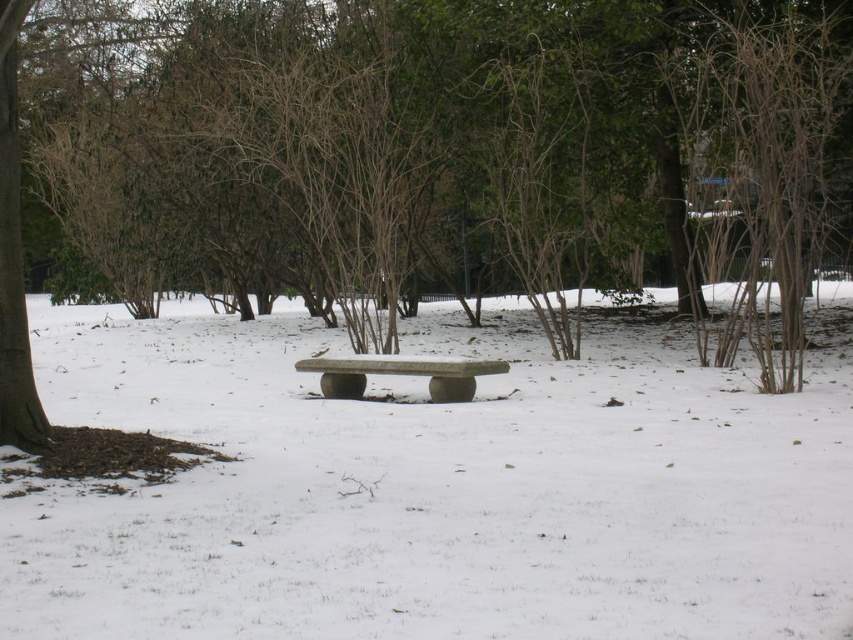
From the picture: You are a maintenance worker needing to place a 2.5 meter long snow plow between the white matte bench at center and the gray stone bench at center. Will the plow fit between them?

The distance between the white matte bench at center and the gray stone bench at center is 2.29 meters, which is shorter than the 2.5 meter long snow plow. Therefore, the plow will not fit between them.

You are standing at the point marked by coordinates point [434,490] in the winter scene. What object are you standing on?

You are standing on the white matte bench at center, as the coordinates point [434,490] marks this location.